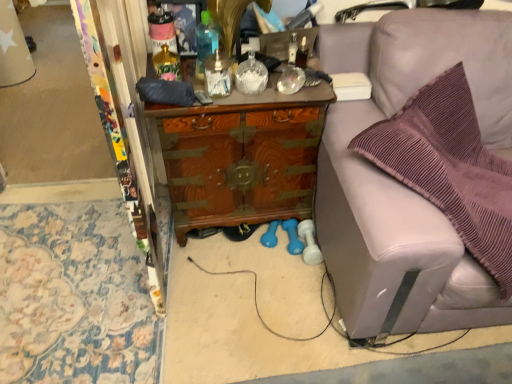
Locate an element on the screen. The height and width of the screenshot is (384, 512). vacant space to the right of black matte remote control at center is located at coordinates (242, 95).